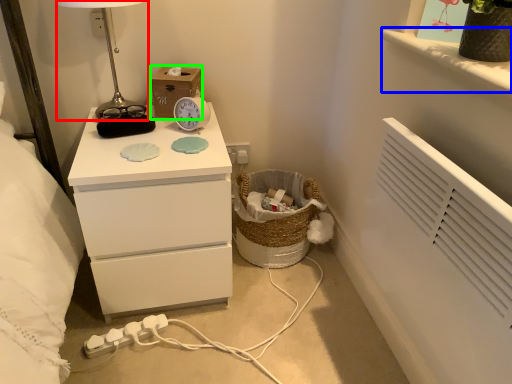
Question: Which object is positioned farthest from table lamp (highlighted by a red box)? Select from window sill (highlighted by a blue box) and cardboard box (highlighted by a green box).

Choices:
 (A) window sill
 (B) cardboard box

Answer: (A)